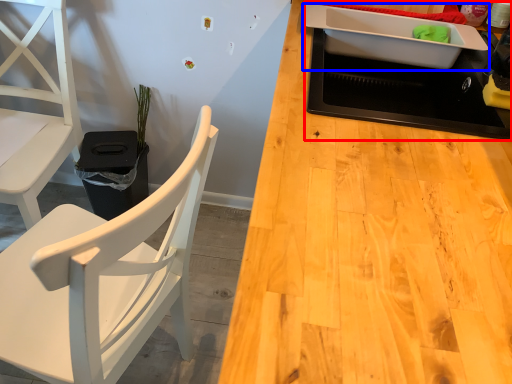
Question: Which of the following is the farthest to the observer, appliance (highlighted by a red box) or kitchen appliance (highlighted by a blue box)?

Choices:
 (A) appliance
 (B) kitchen appliance

Answer: (B)